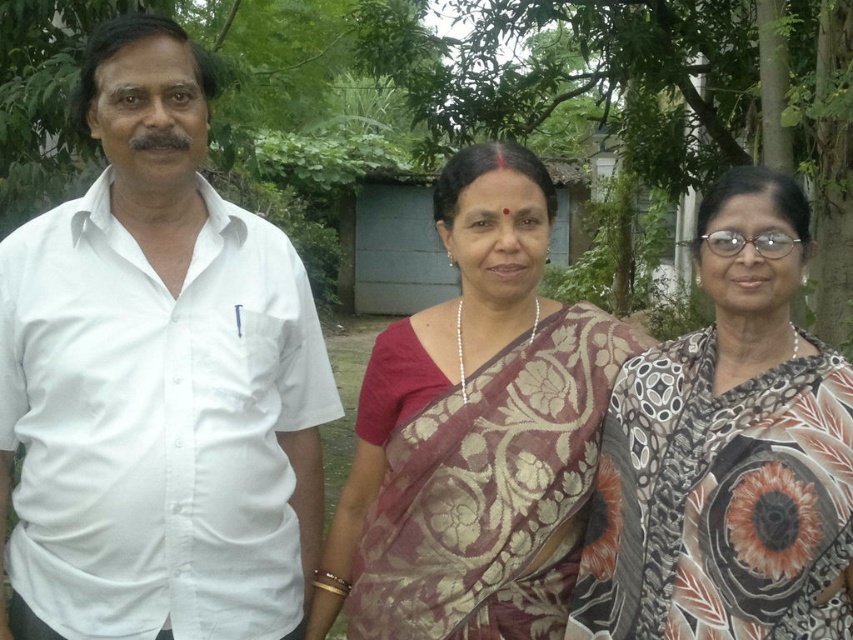
Question: Is white cotton shirt at left further to the viewer compared to green leafy tree at center?

Choices:
 (A) no
 (B) yes

Answer: (A)

Question: Considering the real-world distances, which object is closest to the green leafy tree at center?

Choices:
 (A) maroon floral saree at center
 (B) white cotton shirt at left
 (C) printed silk saree at center

Answer: (A)

Question: Observing the image, what is the correct spatial positioning of printed silk saree at center in reference to green leafy tree at center?

Choices:
 (A) below
 (B) above

Answer: (A)

Question: Does printed silk saree at center have a greater width compared to green leafy tree at center?

Choices:
 (A) no
 (B) yes

Answer: (B)

Question: Which object is closer to the camera taking this photo?

Choices:
 (A) maroon floral saree at center
 (B) white cotton shirt at left

Answer: (B)

Question: Which point appears farthest from the camera in this image?

Choices:
 (A) (457, 340)
 (B) (672, 550)

Answer: (A)